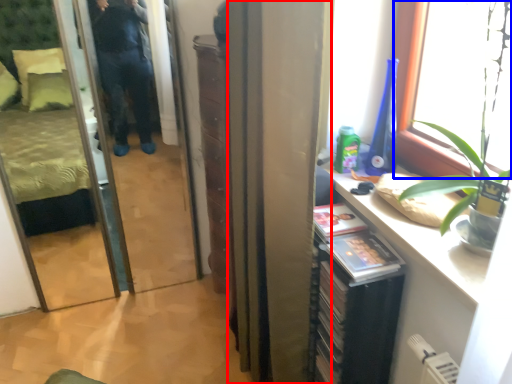
Question: Which object appears farthest to the camera in this image, curtain (highlighted by a red box) or window (highlighted by a blue box)?

Choices:
 (A) curtain
 (B) window

Answer: (A)